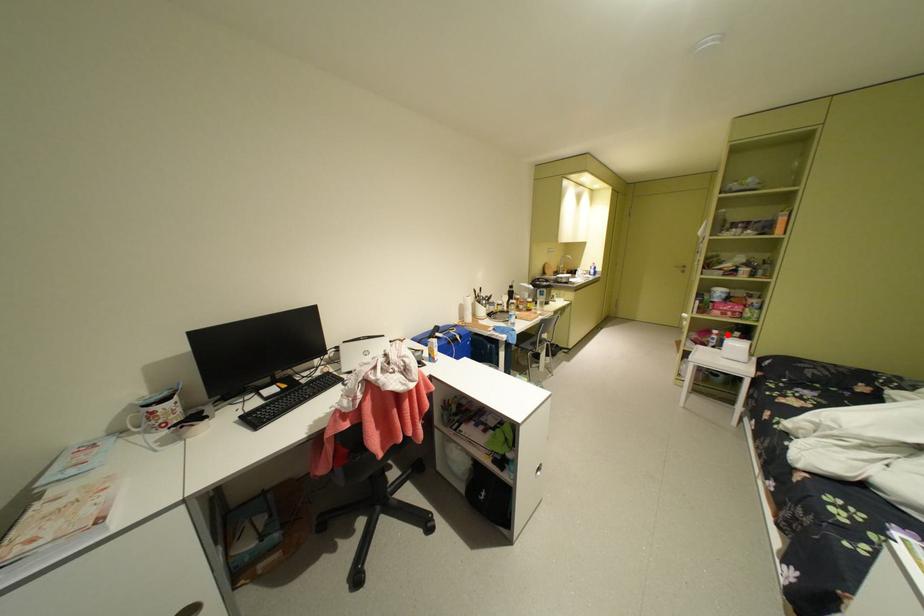
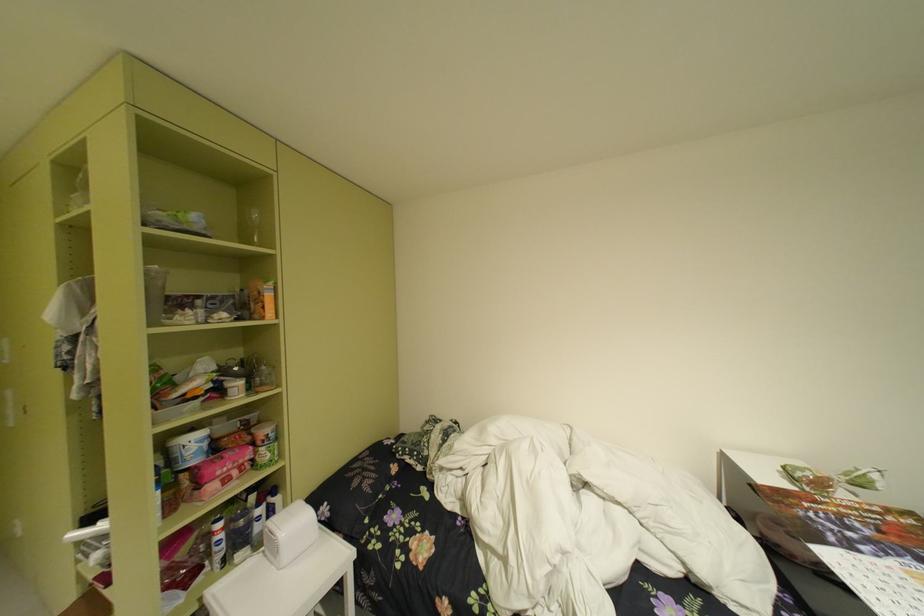
Where in the second image is the point corresponding to the highlighted location from the first image?

(235, 528)